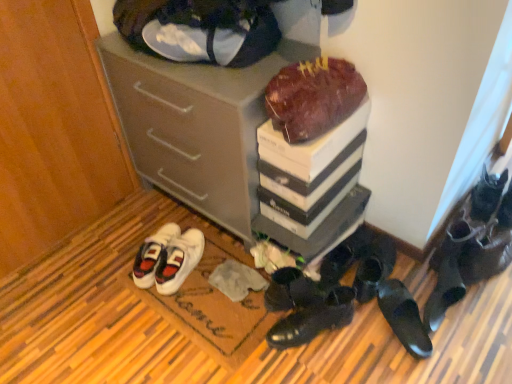
Identify the location of vacant region below black leather shoes at lower right, the 3th footwear viewed from the right (from a real-world perspective). (438, 321).